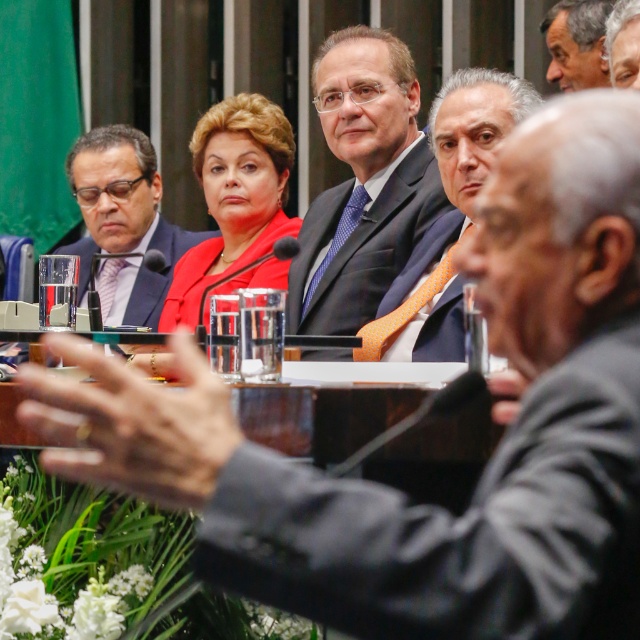
You are a photographer standing at the back of the room with a camera that has a maximum zoom of 2 meters. You want to take a photo of the matte black suit at center and the matte black suit at upper center so that both are clearly visible. Can your camera zoom enough to capture both subjects in focus?

The distance between the matte black suit at center and the matte black suit at upper center is 2.25 meters. Since your camera has a maximum zoom of 2 meters, it cannot fully capture both subjects in focus as the required distance exceeds the camera capabilities.